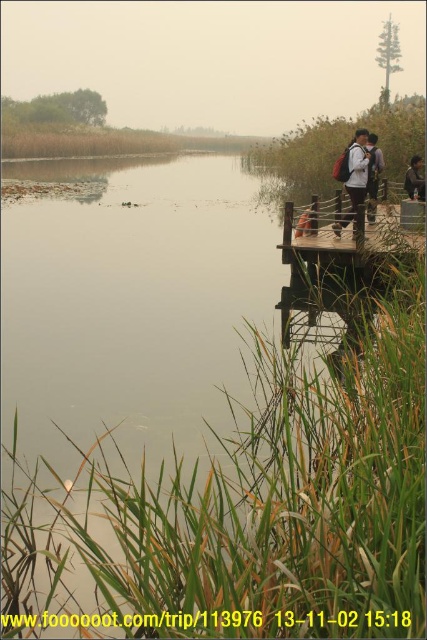
Question: Which point is closer to the camera?

Choices:
 (A) (345, 246)
 (B) (373, 154)
 (C) (341, 172)
 (D) (403, 184)

Answer: (A)

Question: Considering the relative positions of dark gray fabric backpack at right and matte black backpack at upper right in the image provided, where is dark gray fabric backpack at right located with respect to matte black backpack at upper right?

Choices:
 (A) right
 (B) left

Answer: (B)

Question: Is dark gray fabric backpack at right positioned at the back of matte black backpack at upper right?

Choices:
 (A) no
 (B) yes

Answer: (A)

Question: Which object is positioned farthest from the matte black backpack at upper right?

Choices:
 (A) wooden dock at center
 (B) matte brown backpack at upper right

Answer: (A)

Question: Based on their relative distances, which object is farther from the dark gray fabric backpack at right?

Choices:
 (A) matte black backpack at upper right
 (B) wooden dock at center

Answer: (A)

Question: In this image, where is dark gray fabric backpack at right located relative to matte black backpack at upper right?

Choices:
 (A) above
 (B) below

Answer: (B)